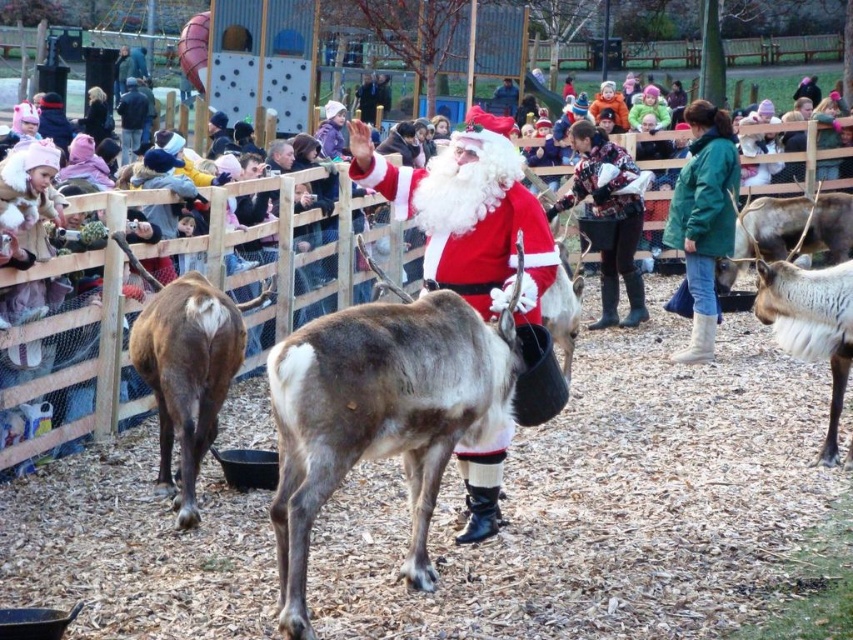
Consider the image. Does brown speckled fur at center appear under white fur reindeer at right?

Yes.

Who is positioned more to the right, brown speckled fur at center or white fur reindeer at right?

From the viewer's perspective, white fur reindeer at right appears more on the right side.

Which is behind, point (363, 458) or point (780, 304)?

Point (780, 304)

In order to click on brown speckled fur at center in this screenshot , I will do `click(381, 413)`.

Does brown speckled fur at center have a lesser height compared to matte red santa at center?

No.

Is brown speckled fur at center smaller than matte red santa at center?

Actually, brown speckled fur at center might be larger than matte red santa at center.

Which is in front, point (285, 436) or point (444, 195)?

Point (285, 436) is more forward.

Identify the location of brown speckled fur at center. This screenshot has width=853, height=640. (381, 413).

Can you confirm if brown fuzzy reindeer at left is taller than white fur reindeer at right?

Indeed, brown fuzzy reindeer at left has a greater height compared to white fur reindeer at right.

Who is taller, brown fuzzy reindeer at left or white fur reindeer at right?

Standing taller between the two is brown fuzzy reindeer at left.

Where is `brown fuzzy reindeer at left`? brown fuzzy reindeer at left is located at coordinates (186, 369).